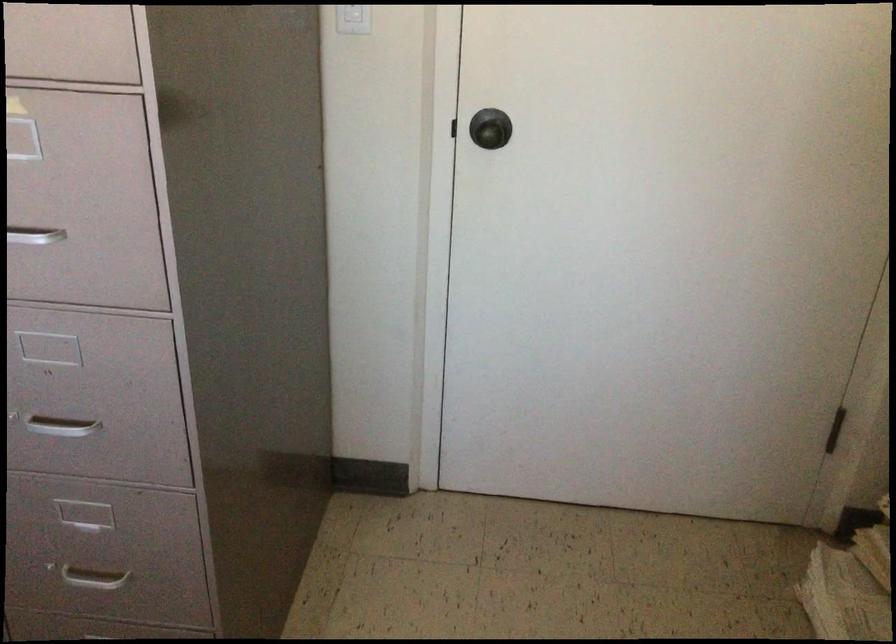
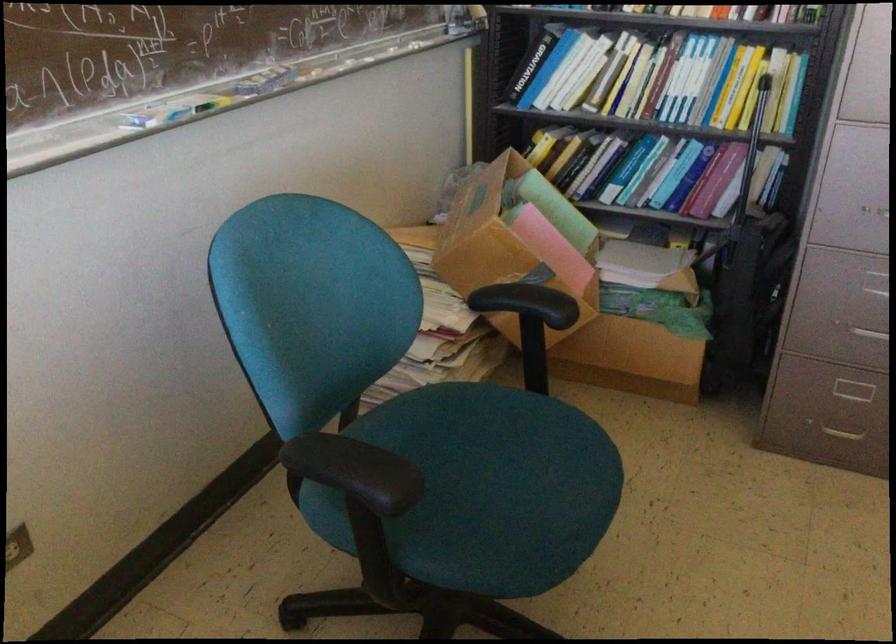
Where in the second image is the point corresponding to the point at 72,424 from the first image?

(877, 214)